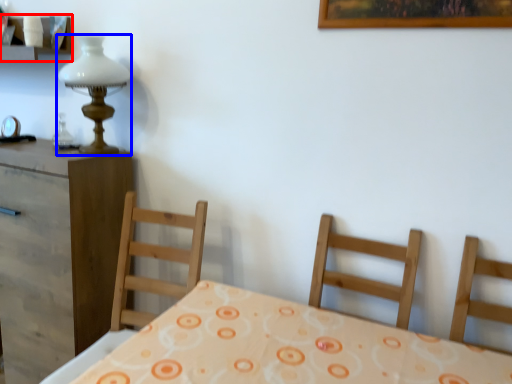
Question: Among these objects, which one is nearest to the camera, shelf (highlighted by a red box) or table lamp (highlighted by a blue box)?

Choices:
 (A) shelf
 (B) table lamp

Answer: (B)